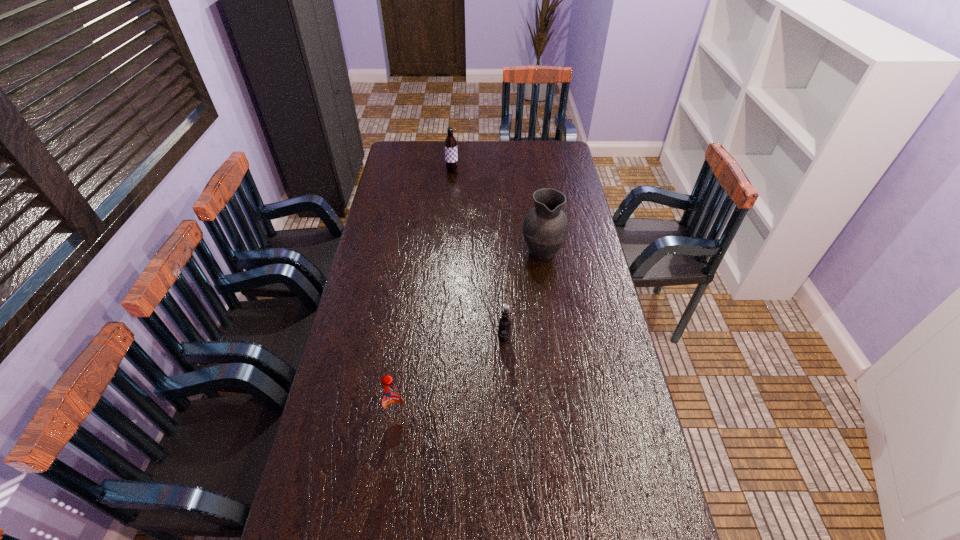
In order to click on vacant space in between the tallest object and the farthest object in this screenshot , I will do `click(497, 211)`.

This screenshot has height=540, width=960. What are the coordinates of `free space between the third object from right to left and the pitcher` in the screenshot? It's located at point(497,211).

The width and height of the screenshot is (960, 540). I want to click on vacant space in between the rightmost object and the farthest object, so click(497, 211).

Locate an element on the screen. The width and height of the screenshot is (960, 540). unoccupied area between the nearest object and the third object from right to left is located at coordinates (425, 295).

Identify the location of free spot between the farthest object and the rightmost root beer. (478, 255).

This screenshot has height=540, width=960. In order to click on vacant space that is in between the pitcher and the second nearest root beer in this screenshot , I will do `click(523, 295)`.

At what (x,y) coordinates should I click in order to perform the action: click on vacant space in between the nearest object and the pitcher. Please return your answer as a coordinate pair (x, y). Looking at the image, I should click on (469, 335).

Find the location of a particular element. The width and height of the screenshot is (960, 540). vacant space in between the nearest object and the second root beer from right to left is located at coordinates (425, 295).

Identify the location of the second closest object relative to the rightmost object. (451, 155).

Choose which object is the third nearest neighbor to the second nearest object. Please provide its 2D coordinates. Your answer should be formatted as a tuple, i.e. [(x, y)], where the tuple contains the x and y coordinates of a point satisfying the conditions above.

[(451, 155)]